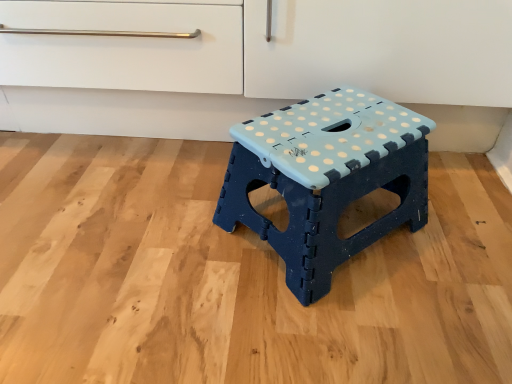
The image size is (512, 384). In order to click on vacant space in front of blue textured stool at center in this screenshot , I will do `click(324, 331)`.